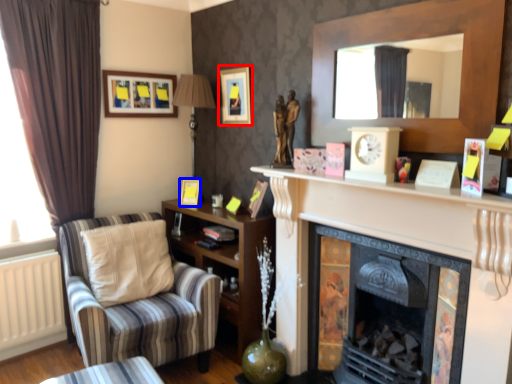
Question: Which point is further to the camera, picture frame (highlighted by a red box) or picture frame (highlighted by a blue box)?

Choices:
 (A) picture frame
 (B) picture frame

Answer: (B)